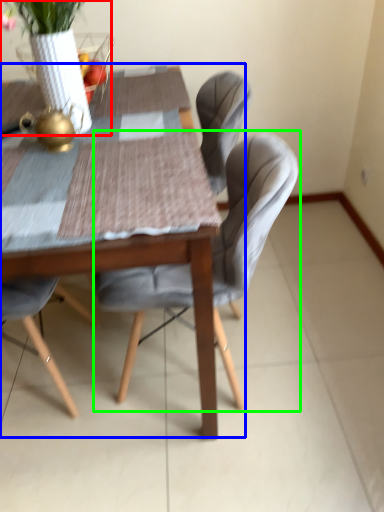
Question: Estimate the real-world distances between objects in this image. Which object is closer to floral arrangement (highlighted by a red box), kitchen & dining room table (highlighted by a blue box) or chair (highlighted by a green box)?

Choices:
 (A) kitchen & dining room table
 (B) chair

Answer: (A)